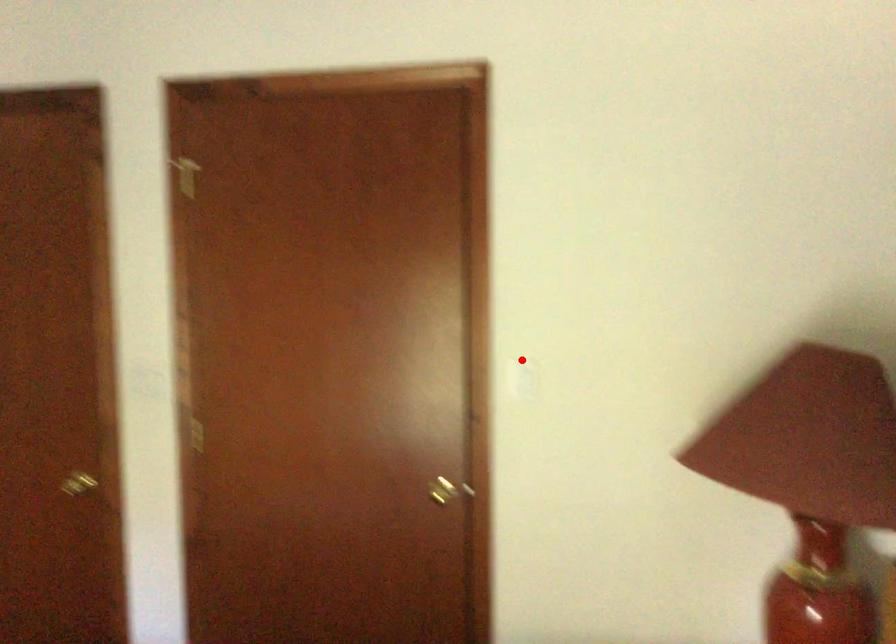
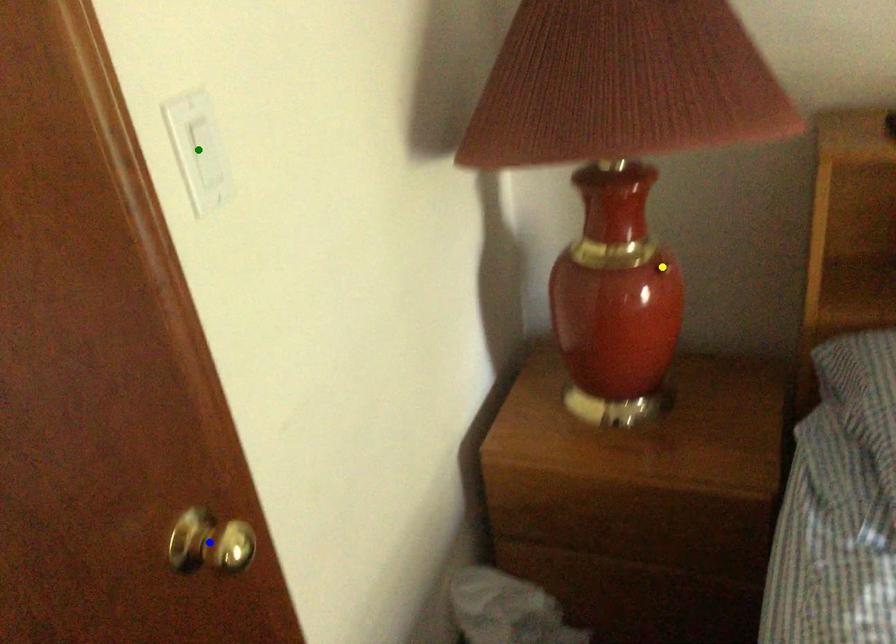
Question: I am providing you with two images of the same scene from different viewpoints. A red point is marked on the first image. You are given multiple points on the second image. Which point in image 2 is actually the same real-world point as the red point in image 1?

Choices:
 (A) yellow point
 (B) blue point
 (C) green point

Answer: (C)